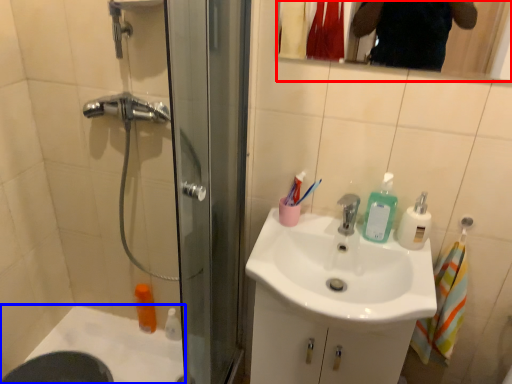
Question: Among these objects, which one is nearest to the camera, mirror (highlighted by a red box) or bath (highlighted by a blue box)?

Choices:
 (A) mirror
 (B) bath

Answer: (A)